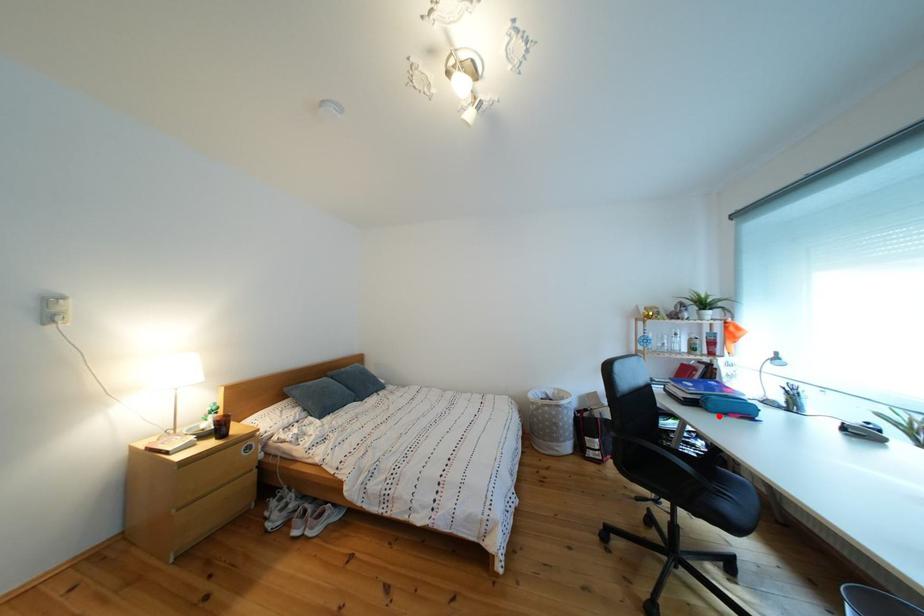
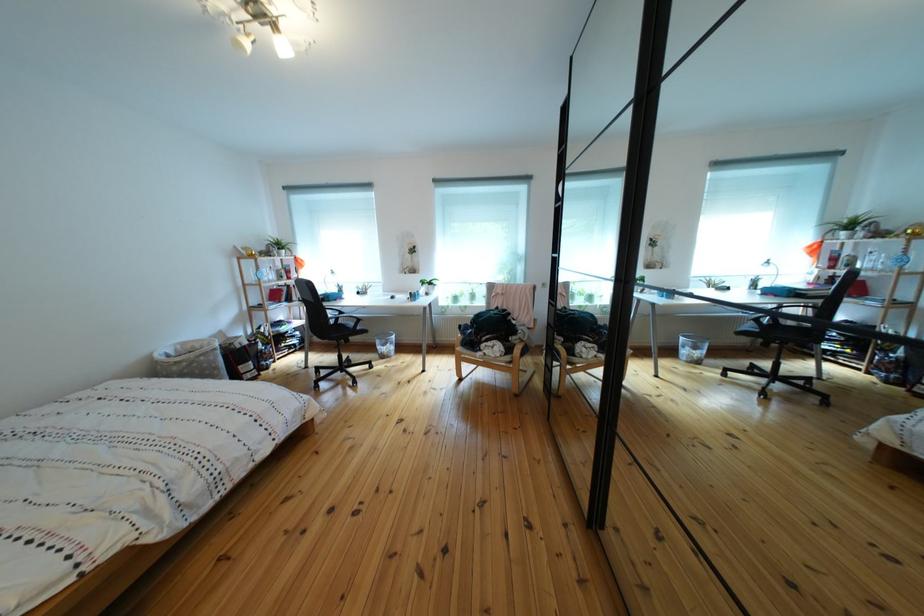
Find the pixel in the second image that matches the highlighted location in the first image.

(341, 307)